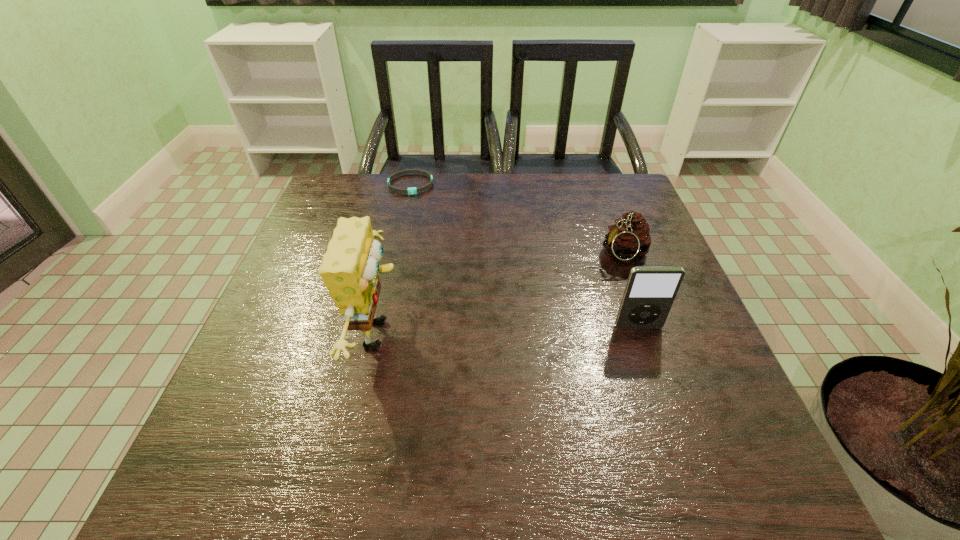
Where is `free space between the farthest object and the pinecone`? free space between the farthest object and the pinecone is located at coordinates (517, 220).

Locate an element on the screen. The height and width of the screenshot is (540, 960). empty location between the pinecone and the sponge is located at coordinates (502, 294).

Where is `vacant area that lies between the tallest object and the wristband`? Image resolution: width=960 pixels, height=540 pixels. vacant area that lies between the tallest object and the wristband is located at coordinates (x=396, y=259).

Point out which object is positioned as the third nearest to the iPod. Please provide its 2D coordinates. Your answer should be formatted as a tuple, i.e. [(x, y)], where the tuple contains the x and y coordinates of a point satisfying the conditions above.

[(413, 190)]

This screenshot has height=540, width=960. Identify the location of object that is the closest to the pinecone. (649, 294).